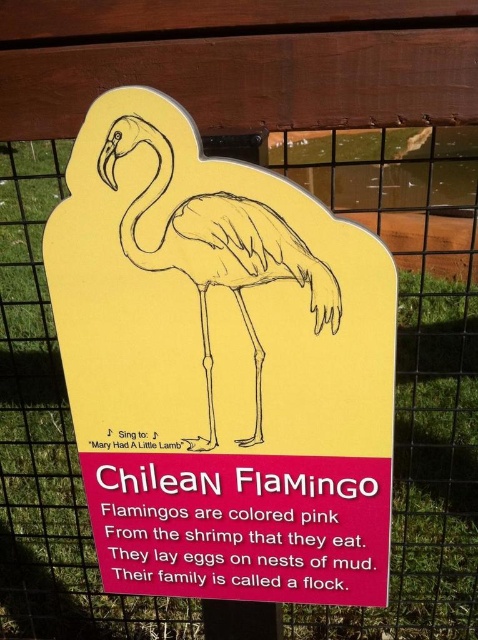
Question: Can you confirm if yellow cardboard sign at center is positioned to the left of pink paper flamingo at center?

Choices:
 (A) no
 (B) yes

Answer: (B)

Question: Which object appears closest to the camera in this image?

Choices:
 (A) yellow cardboard sign at center
 (B) pink paper flamingo at center

Answer: (A)

Question: Which point is closer to the camera?

Choices:
 (A) (213, 170)
 (B) (170, 241)

Answer: (A)

Question: Is yellow cardboard sign at center positioned behind pink paper flamingo at center?

Choices:
 (A) yes
 (B) no

Answer: (B)

Question: Considering the relative positions of yellow cardboard sign at center and pink paper flamingo at center in the image provided, where is yellow cardboard sign at center located with respect to pink paper flamingo at center?

Choices:
 (A) left
 (B) right

Answer: (A)

Question: Which of the following is the farthest from the observer?

Choices:
 (A) (206, 444)
 (B) (97, 536)

Answer: (B)